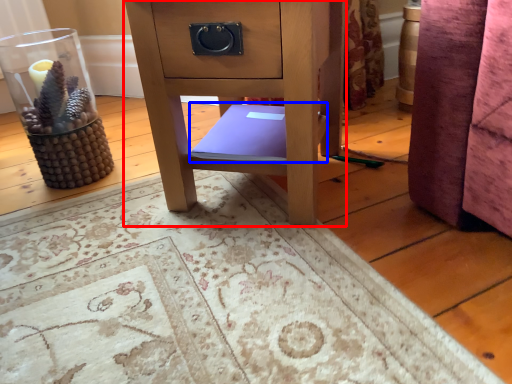
Question: Which object is closer to the camera taking this photo, furniture (highlighted by a red box) or book (highlighted by a blue box)?

Choices:
 (A) furniture
 (B) book

Answer: (A)